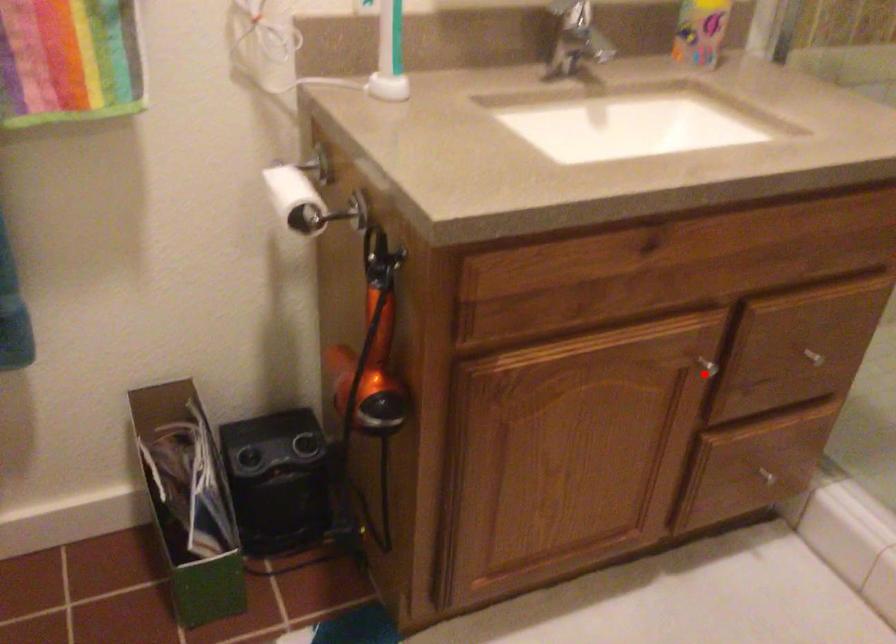
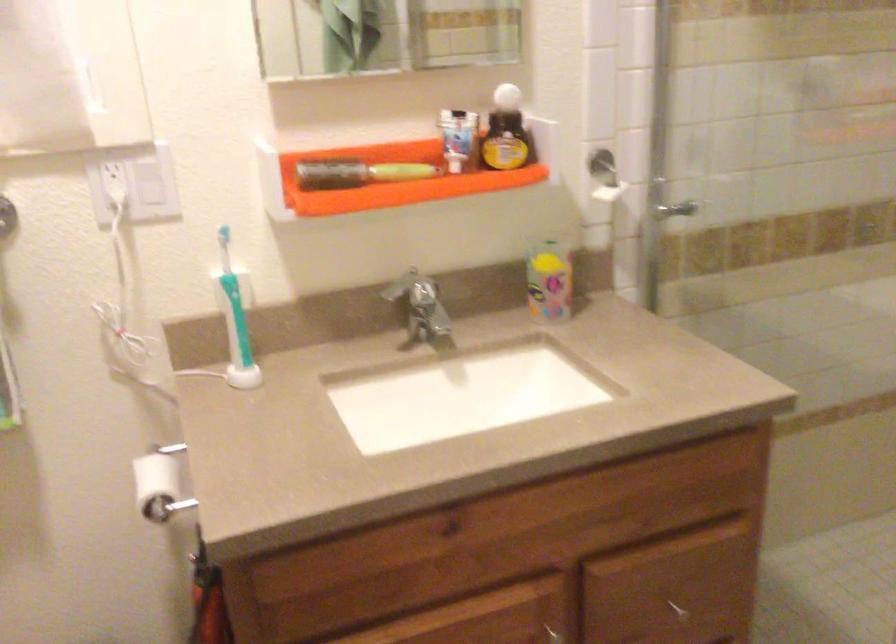
Locate, in the second image, the point that corresponds to the highlighted location in the first image.

(555, 635)